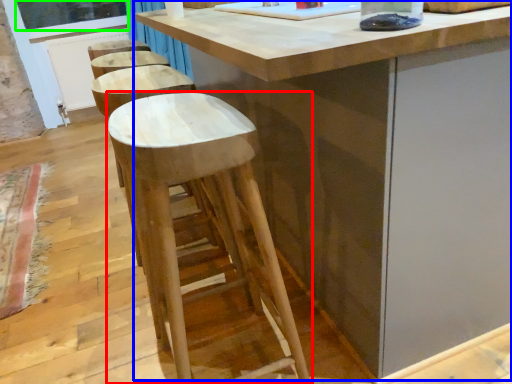
Question: Which object is positioned farthest from stool (highlighted by a red box)? Select from table (highlighted by a blue box) and window screen (highlighted by a green box).

Choices:
 (A) table
 (B) window screen

Answer: (B)